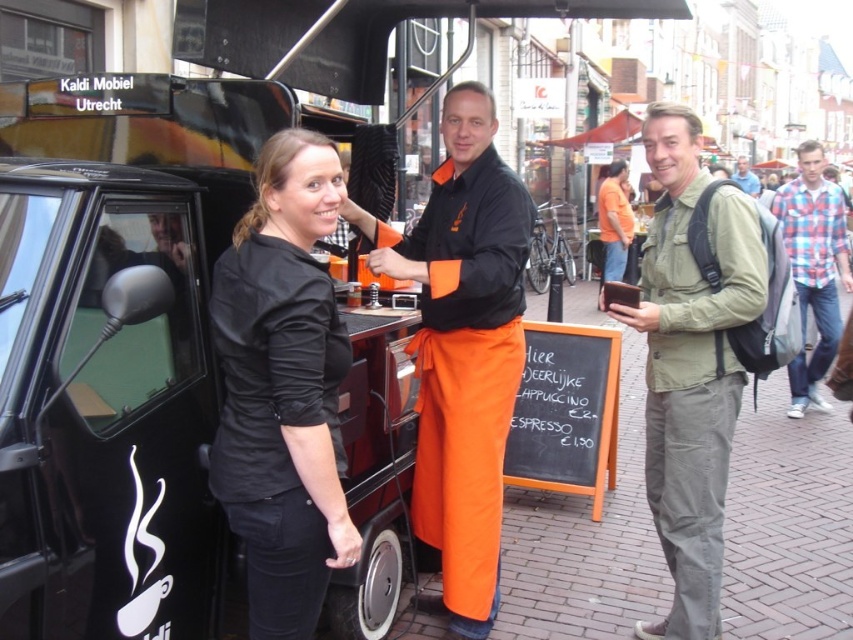
Is point (122, 230) closer to viewer compared to point (741, 177)?

That is True.

Consider the image. Does black matte van at left have a larger size compared to blue denim jacket at upper right?

No.

Which is behind, point (22, 214) or point (738, 161)?

The point (738, 161) is more distant.

This screenshot has height=640, width=853. Find the location of `black matte van at left`. black matte van at left is located at coordinates (109, 406).

Between black matte shirt at left and orange fabric apron at center, which one appears on the left side from the viewer's perspective?

black matte shirt at left is more to the left.

Does black matte shirt at left appear over orange fabric apron at center?

Correct, black matte shirt at left is located above orange fabric apron at center.

Who is more distant from viewer, (289, 252) or (463, 387)?

The point (463, 387) is behind.

Find the location of a particular element. This screenshot has height=640, width=853. black matte shirt at left is located at coordinates (283, 388).

In the scene shown: Can you confirm if black matte van at left is smaller than orange fabric apron at center?

Yes, black matte van at left is smaller than orange fabric apron at center.

Can you confirm if black matte van at left is positioned to the left of orange fabric apron at center?

Yes, black matte van at left is to the left of orange fabric apron at center.

The image size is (853, 640). What do you see at coordinates (109, 406) in the screenshot? I see `black matte van at left` at bounding box center [109, 406].

Locate an element on the screen. The image size is (853, 640). black matte van at left is located at coordinates (109, 406).